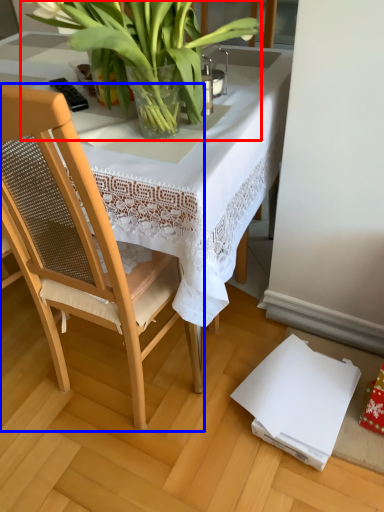
Question: Which point is further to the camera, houseplant (highlighted by a red box) or chair (highlighted by a blue box)?

Choices:
 (A) houseplant
 (B) chair

Answer: (A)